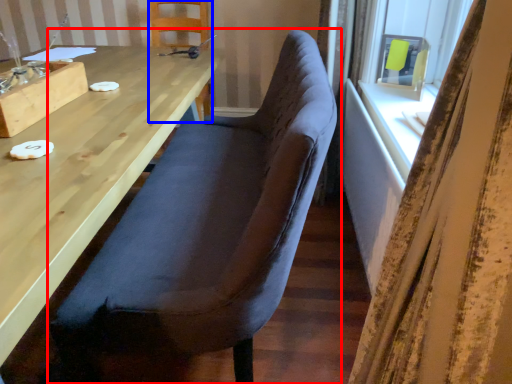
Question: Which point is further to the camera, chair (highlighted by a red box) or chair (highlighted by a blue box)?

Choices:
 (A) chair
 (B) chair

Answer: (B)